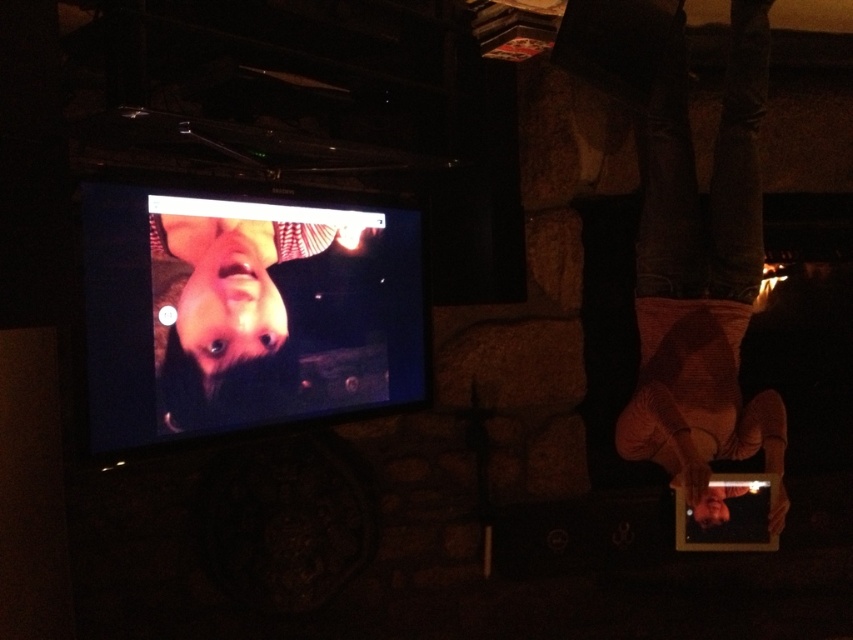
Does point (737, 19) lie in front of point (207, 298)?

No, it is not.

Is point (753, 410) more distant than point (198, 406)?

Yes, point (753, 410) is behind point (198, 406).

Where is `striped sweater at lower right`? This screenshot has width=853, height=640. striped sweater at lower right is located at coordinates (701, 273).